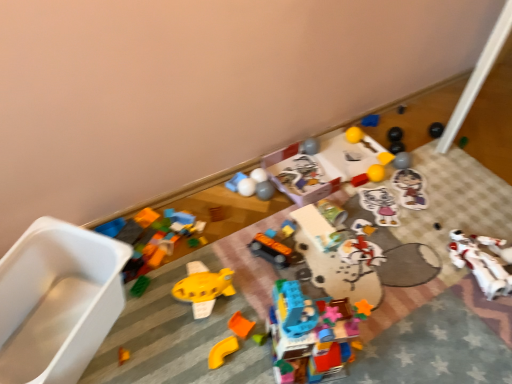
Find the location of a particular element. Image resolution: width=512 pixels, height=384 pixels. free space that is in between matte white plush cat at center, the thirteenth toy viewed from the left, and orange matte block at center, which is the thirteenth toy from right to left is located at coordinates (335, 249).